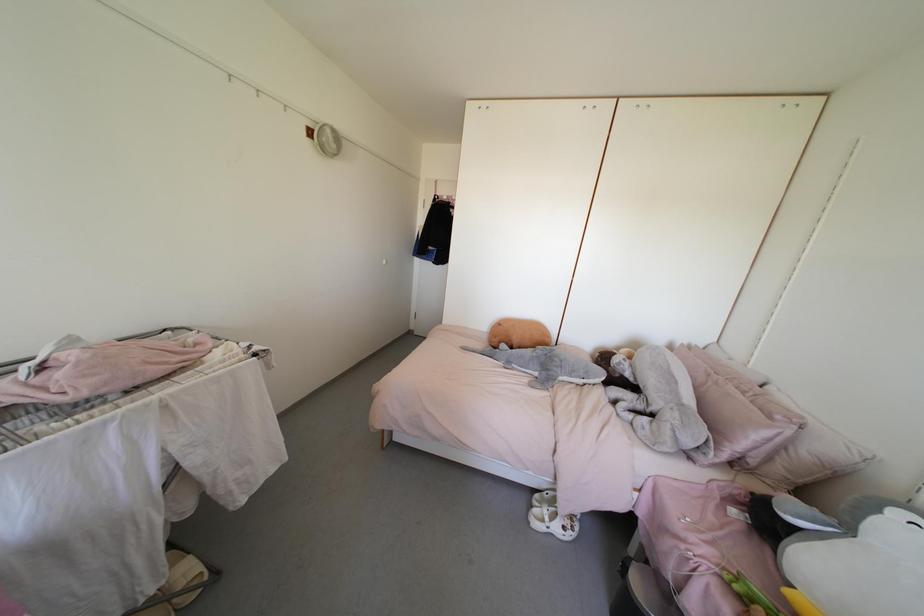
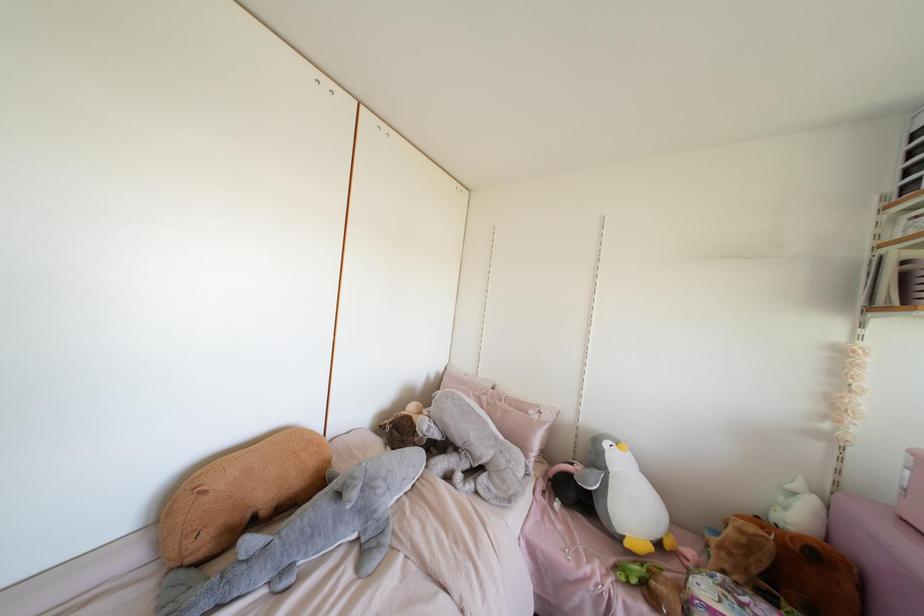
Where in the second image is the point corresponding to point 573,371 from the first image?

(403, 479)